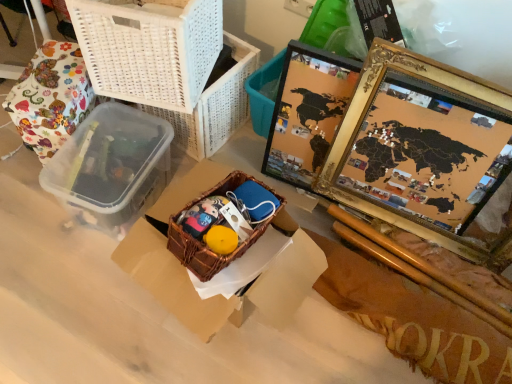
Question: Is floral fabric wrapped object at left located outside woven brown basket at center?

Choices:
 (A) no
 (B) yes

Answer: (B)

Question: Does floral fabric wrapped object at left have a larger size compared to woven brown basket at center?

Choices:
 (A) no
 (B) yes

Answer: (B)

Question: Is floral fabric wrapped object at left directly adjacent to woven brown basket at center?

Choices:
 (A) yes
 (B) no

Answer: (B)

Question: Does floral fabric wrapped object at left have a greater height compared to woven brown basket at center?

Choices:
 (A) yes
 (B) no

Answer: (A)

Question: Is floral fabric wrapped object at left positioned behind woven brown basket at center?

Choices:
 (A) no
 (B) yes

Answer: (B)

Question: Considering the positions of point (193, 21) and point (162, 183), is point (193, 21) closer or farther from the camera than point (162, 183)?

Choices:
 (A) closer
 (B) farther

Answer: (A)

Question: From the image's perspective, is white woven basket at upper left positioned above or below transparent plastic lunch box at left?

Choices:
 (A) below
 (B) above

Answer: (B)

Question: Is white woven basket at upper left taller or shorter than transparent plastic lunch box at left?

Choices:
 (A) tall
 (B) short

Answer: (A)

Question: Looking at their shapes, would you say white woven basket at upper left is wider or thinner than transparent plastic lunch box at left?

Choices:
 (A) wide
 (B) thin

Answer: (B)

Question: Considering the positions of point (117, 145) and point (45, 160), is point (117, 145) closer or farther from the camera than point (45, 160)?

Choices:
 (A) farther
 (B) closer

Answer: (A)

Question: Is transparent plastic lunch box at left in front of or behind floral fabric wrapped object at left in the image?

Choices:
 (A) behind
 (B) front

Answer: (B)

Question: From the image's perspective, is transparent plastic lunch box at left located above or below floral fabric wrapped object at left?

Choices:
 (A) below
 (B) above

Answer: (A)

Question: Which is correct: transparent plastic lunch box at left is inside floral fabric wrapped object at left, or outside of it?

Choices:
 (A) outside
 (B) inside

Answer: (A)

Question: Is brown woven basket at center bigger or smaller than woven brown basket at center?

Choices:
 (A) big
 (B) small

Answer: (A)

Question: From a real-world perspective, relative to woven brown basket at center, is brown woven basket at center vertically above or below?

Choices:
 (A) below
 (B) above

Answer: (A)